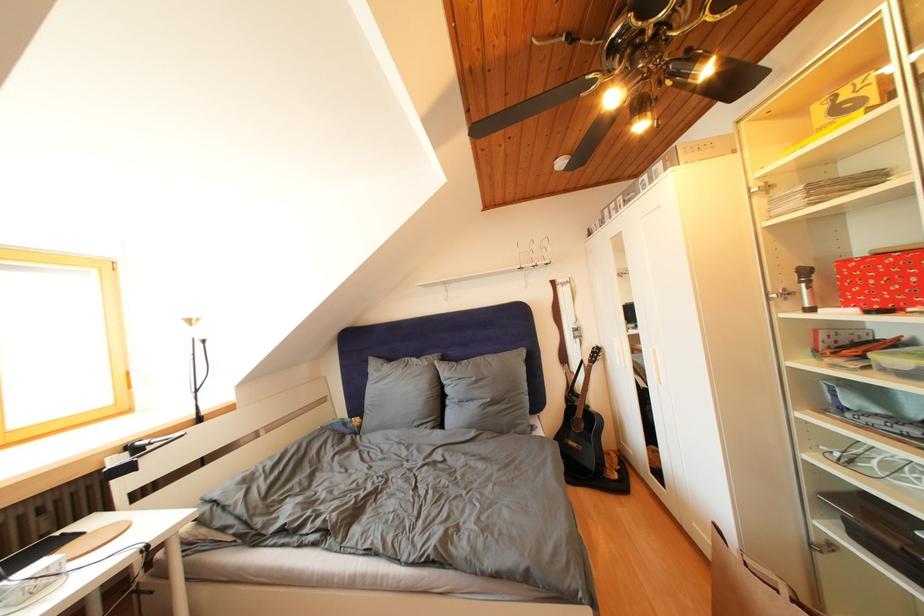
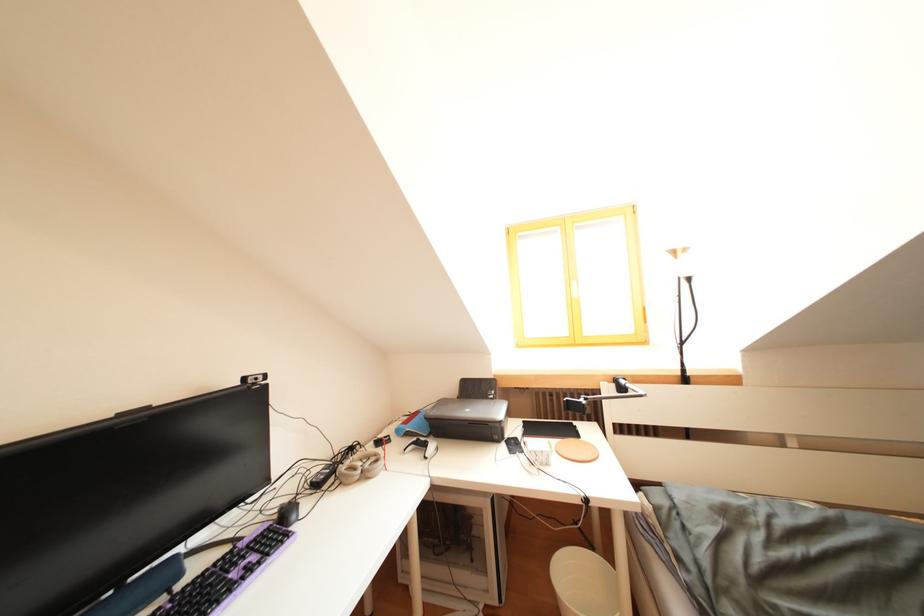
Question: The first image is from the beginning of the video and the second image is from the end. How did the camera likely rotate when shooting the video?

Choices:
 (A) Left
 (B) Right
 (C) Up
 (D) Down

Answer: (A)